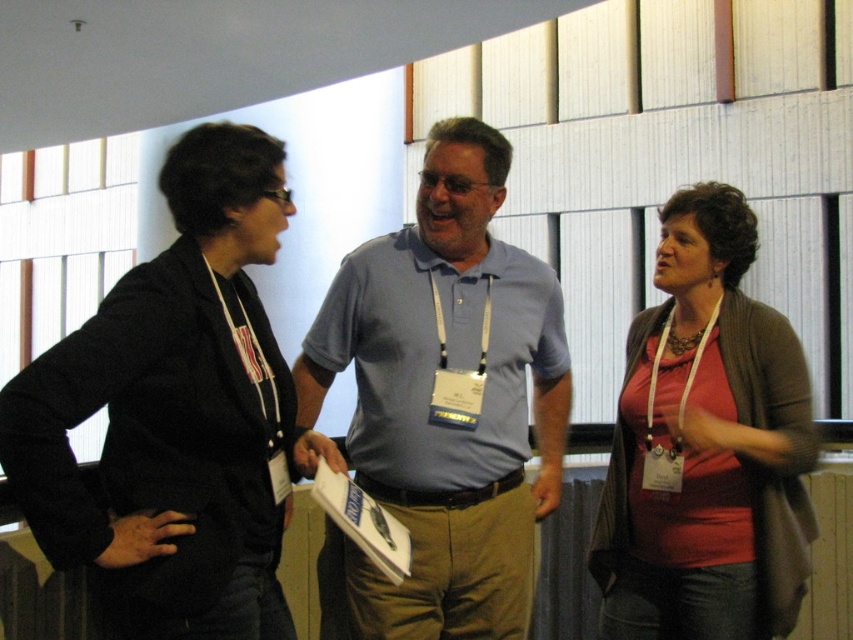
Question: Which is nearer to the light blue cotton shirt at center?

Choices:
 (A) matte red shirt at center
 (B) matte black blazer at left

Answer: (A)

Question: Can you confirm if matte black blazer at left is thinner than matte red shirt at center?

Choices:
 (A) no
 (B) yes

Answer: (B)

Question: Which object appears farthest from the camera in this image?

Choices:
 (A) matte black blazer at left
 (B) matte red shirt at center

Answer: (B)

Question: Does matte black blazer at left come in front of light blue cotton shirt at center?

Choices:
 (A) yes
 (B) no

Answer: (A)

Question: Considering the real-world distances, which object is farthest from the light blue cotton shirt at center?

Choices:
 (A) matte black blazer at left
 (B) matte red shirt at center

Answer: (A)

Question: Is matte black blazer at left to the right of light blue cotton shirt at center from the viewer's perspective?

Choices:
 (A) no
 (B) yes

Answer: (A)